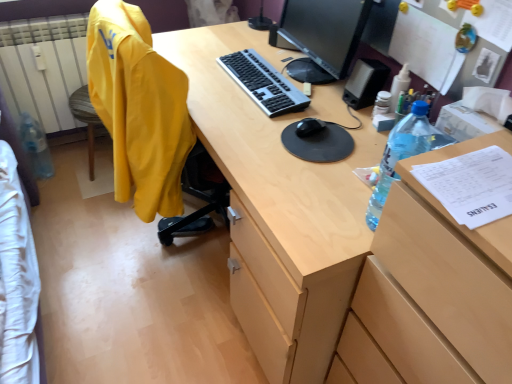
Find the location of a particular element. free area in between translucent plastic bottle at right, placed as the first bottle when sorted from right to left, and silver/black plastic keyboard at center is located at coordinates (324, 152).